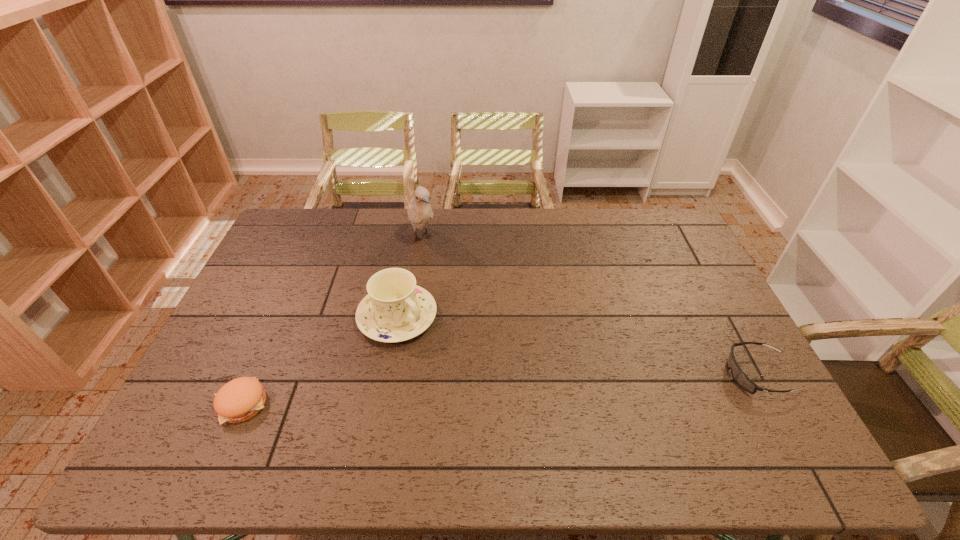
Identify the location of vacant area that satisfies the following two spatial constraints: 1. on the front side of the goggles; 2. on the lenses of the tallest object. Image resolution: width=960 pixels, height=540 pixels. (399, 374).

Image resolution: width=960 pixels, height=540 pixels. I want to click on free space that satisfies the following two spatial constraints: 1. on the back side of the chinaware; 2. on the right side of the tallest object, so click(x=412, y=238).

Locate an element on the screen. The width and height of the screenshot is (960, 540). free space in the image that satisfies the following two spatial constraints: 1. on the back side of the second tallest object; 2. on the right side of the bird is located at coordinates (412, 238).

You are a GUI agent. You are given a task and a screenshot of the screen. Output one action in this format:
    pyautogui.click(x=<x>, y=<y>)
    Task: Click on the free space that satisfies the following two spatial constraints: 1. on the front side of the farthest object; 2. on the lenses of the rightmost object
    The width and height of the screenshot is (960, 540).
    Given the screenshot: What is the action you would take?
    pyautogui.click(x=399, y=374)

The width and height of the screenshot is (960, 540). What are the coordinates of `vacant position in the image that satisfies the following two spatial constraints: 1. on the back side of the goggles; 2. on the lenses of the leftmost object` in the screenshot? It's located at (255, 374).

The image size is (960, 540). Identify the location of free space that satisfies the following two spatial constraints: 1. on the back side of the bird; 2. on the left side of the leftmost object. (315, 238).

The width and height of the screenshot is (960, 540). I want to click on free location that satisfies the following two spatial constraints: 1. on the back side of the third shortest object; 2. on the left side of the tallest object, so click(412, 238).

The height and width of the screenshot is (540, 960). Find the location of `free region that satisfies the following two spatial constraints: 1. on the front side of the chinaware; 2. on the lenses of the rightmost object`. free region that satisfies the following two spatial constraints: 1. on the front side of the chinaware; 2. on the lenses of the rightmost object is located at coordinates (387, 374).